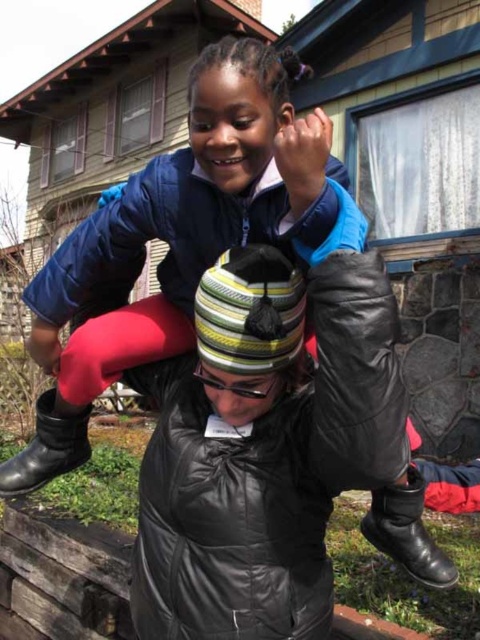
Is black leather boot at lower center shorter than black leather boot at lower left?

No, black leather boot at lower center is not shorter than black leather boot at lower left.

Who is lower down, black leather boot at lower center or black leather boot at lower left?

black leather boot at lower center is lower down.

Find the location of `black leather boot at lower center`. black leather boot at lower center is located at coordinates (407, 532).